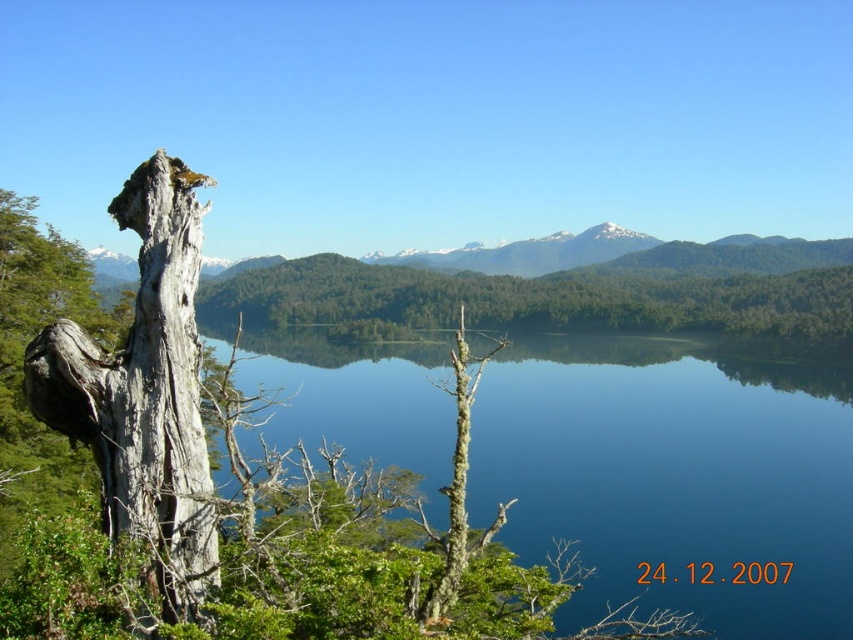
Which is more to the left, blue glassy water at center or gray rough bark tree trunk at left?

gray rough bark tree trunk at left

Between point (399, 467) and point (177, 484), which one is positioned behind?

The point (399, 467) is behind.

Which is behind, point (315, 413) or point (157, 500)?

The point (315, 413) is behind.

You are a GUI agent. You are given a task and a screenshot of the screen. Output one action in this format:
    pyautogui.click(x=<x>, y=<y>)
    Task: Click on the blue glassy water at center
    The width and height of the screenshot is (853, 640).
    Given the screenshot: What is the action you would take?
    pyautogui.click(x=672, y=477)

Between point (393, 605) and point (192, 396), which one is positioned in front?

Point (393, 605)

Identify the location of gray rough bark tree at left. The image size is (853, 640). (238, 492).

Is gray rough bark tree at left shorter than blue glassy water at center?

Yes.

Which is above, gray rough bark tree at left or blue glassy water at center?

gray rough bark tree at left

Which is behind, point (76, 394) or point (733, 595)?

The point (733, 595) is behind.

You are a GUI agent. You are given a task and a screenshot of the screen. Output one action in this format:
    pyautogui.click(x=<x>, y=<y>)
    Task: Click on the gray rough bark tree at left
    
    Given the screenshot: What is the action you would take?
    pyautogui.click(x=238, y=492)